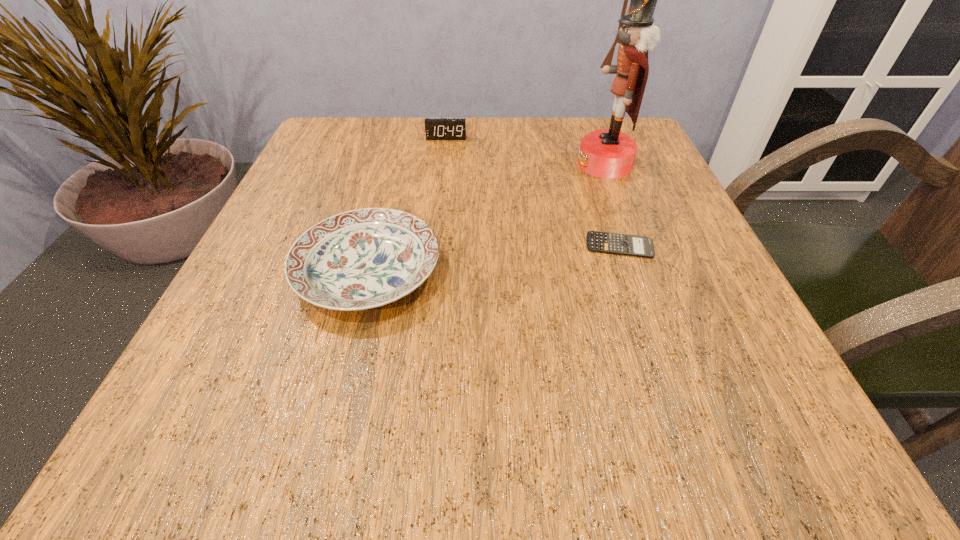
Locate an element on the screen. Image resolution: width=960 pixels, height=540 pixels. free point at the right edge is located at coordinates (780, 400).

Image resolution: width=960 pixels, height=540 pixels. In the image, there is a desktop. Find the location of `vacant space at the far left corner`. vacant space at the far left corner is located at coordinates (341, 148).

The image size is (960, 540). What are the coordinates of `free space that is in between the calculator and the farthest object` in the screenshot? It's located at (x=533, y=192).

This screenshot has width=960, height=540. I want to click on vacant space in between the second farthest object and the calculator, so click(612, 205).

Locate an element on the screen. This screenshot has width=960, height=540. vacant region between the calculator and the plate is located at coordinates (493, 258).

Locate an element on the screen. free space between the tallest object and the third tallest object is located at coordinates (486, 218).

The width and height of the screenshot is (960, 540). I want to click on free point between the plate and the third nearest object, so click(486, 218).

Image resolution: width=960 pixels, height=540 pixels. I want to click on blank region between the farthest object and the shortest object, so click(x=533, y=192).

Identify the location of vacant area that lies between the tallest object and the plate. The image size is (960, 540). (486, 218).

What are the coordinates of `vacant area that lies between the plate and the shortest object` in the screenshot? It's located at (493, 258).